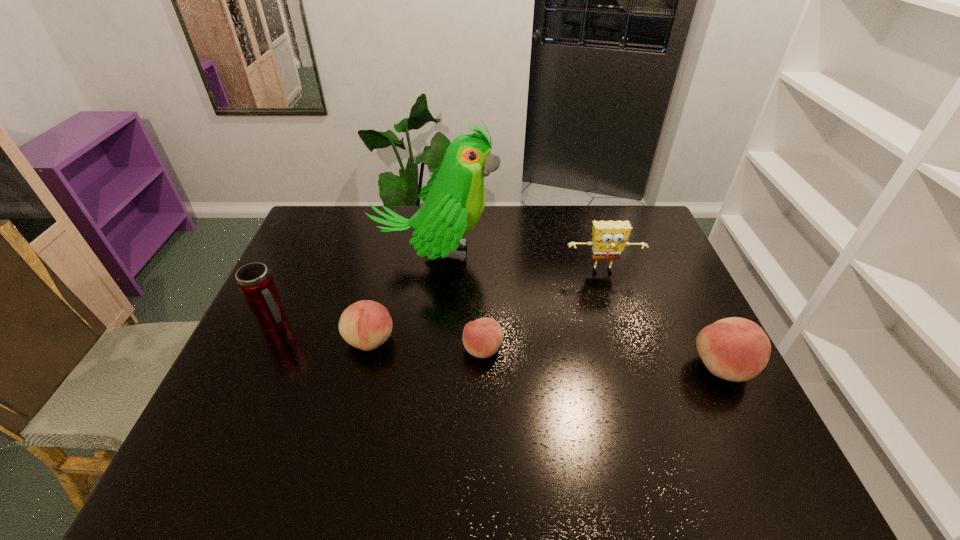
Identify the location of the fifth tallest object. Image resolution: width=960 pixels, height=540 pixels. (366, 324).

Identify the location of the leftmost peach. (366, 324).

I want to click on the second peach from left to right, so click(482, 338).

This screenshot has width=960, height=540. I want to click on the shortest object, so click(x=482, y=338).

You are a GUI agent. You are given a task and a screenshot of the screen. Output one action in this format:
    pyautogui.click(x=<x>, y=<y>)
    Task: Click on the rightmost peach
    
    Given the screenshot: What is the action you would take?
    pyautogui.click(x=735, y=349)

I want to click on the tallest peach, so click(735, 349).

I want to click on the tallest object, so click(x=454, y=198).

You are a GUI agent. You are given a task and a screenshot of the screen. Output one action in this format:
    pyautogui.click(x=<x>, y=<y>)
    Task: Click on the sponge
    This screenshot has width=960, height=540.
    Given the screenshot: What is the action you would take?
    pyautogui.click(x=609, y=238)

Identify the location of the leftmost object. (255, 282).

Locate an element on the screen. This screenshot has width=960, height=540. vacant point located 0.130m on the left of the second shortest peach is located at coordinates (296, 341).